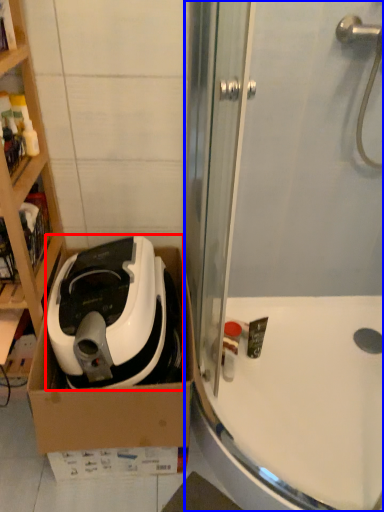
Question: Which point is further to the camera, home appliance (highlighted by a red box) or shower door (highlighted by a blue box)?

Choices:
 (A) home appliance
 (B) shower door

Answer: (A)